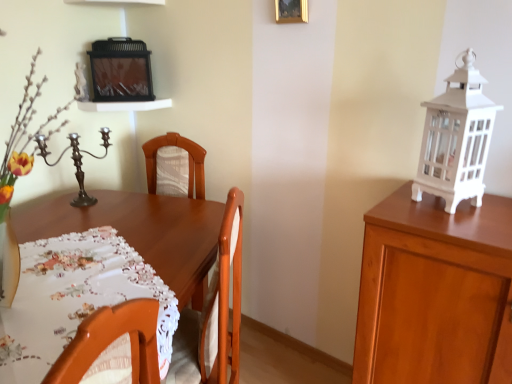
Identify the location of vacant space situated on the left part of white painted glass lantern at right. This screenshot has height=384, width=512. (406, 208).